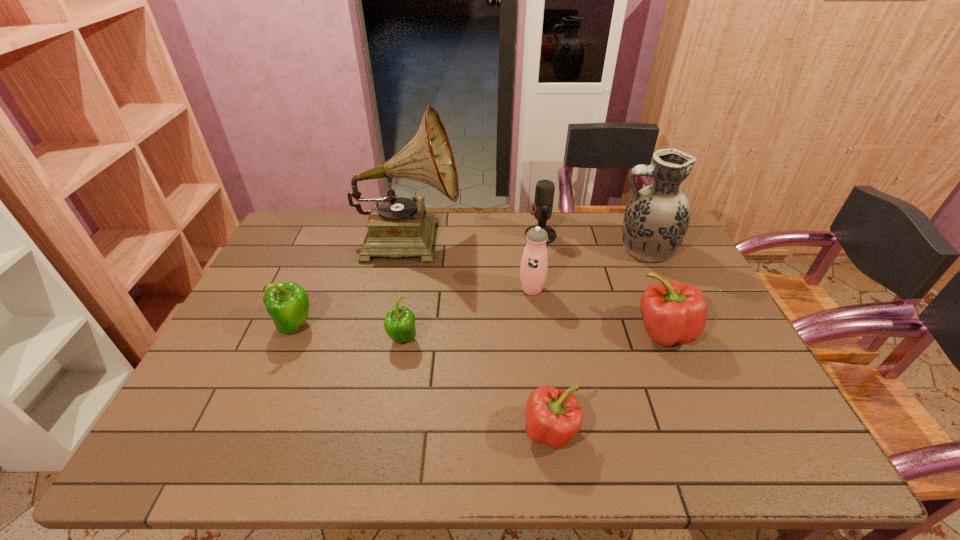
What are the coordinates of `the second bell pepper from left to right` in the screenshot? It's located at click(x=399, y=324).

Image resolution: width=960 pixels, height=540 pixels. I want to click on the left pink bell pepper, so click(553, 416).

What are the coordinates of `the nearer pink bell pepper` in the screenshot? It's located at click(x=553, y=416).

This screenshot has height=540, width=960. In order to click on vacant space located 0.250m from the horn of the record player in this screenshot , I will do `click(532, 238)`.

At what (x,y) coordinates should I click in order to perform the action: click on vacant space located 0.170m with the handle on the side of the vase. Please return your answer as a coordinate pair (x, y). This screenshot has width=960, height=540. Looking at the image, I should click on (563, 249).

Image resolution: width=960 pixels, height=540 pixels. What are the coordinates of `vacant space located 0.290m with the handle on the side of the vase` in the screenshot? It's located at (527, 249).

I want to click on vacant space located 0.140m with the handle on the side of the vase, so click(x=571, y=249).

Identify the location of free point located 0.320m on the front of the fourth farthest object. (544, 390).

At what (x,y) coordinates should I click in order to perform the action: click on vacant point located 0.130m on the side of the microphone with the red ring. Please return your answer as a coordinate pair (x, y). This screenshot has width=960, height=540. Looking at the image, I should click on (488, 235).

The height and width of the screenshot is (540, 960). In order to click on vacant region located on the side of the microphone with the red ring in this screenshot , I will do `click(505, 235)`.